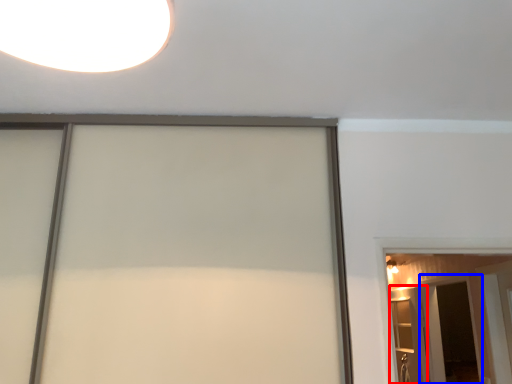
Question: Among these objects, which one is farthest to the camera, elevator (highlighted by a red box) or screen door (highlighted by a blue box)?

Choices:
 (A) elevator
 (B) screen door

Answer: (B)